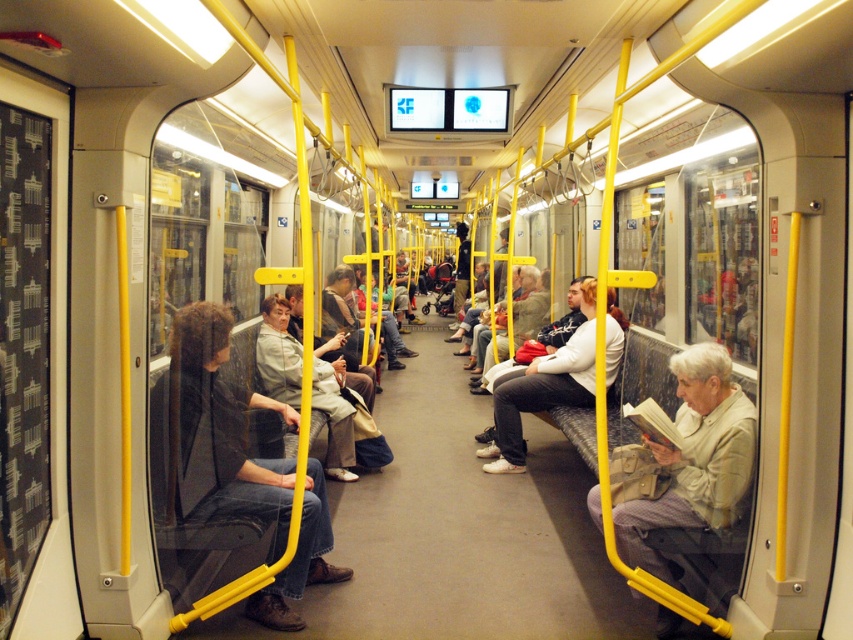
Can you confirm if dark gray jeans at center is shorter than light beige jacket at center?

In fact, dark gray jeans at center may be taller than light beige jacket at center.

Does dark gray jeans at center come behind light beige jacket at center?

Yes, it is.

Which is behind, point (227, 410) or point (675, 464)?

The point (227, 410) is more distant.

Identify the location of dark gray jeans at center. (213, 433).

Describe the element at coordinates (213, 433) in the screenshot. I see `dark gray jeans at center` at that location.

Where is `dark gray jeans at center`? This screenshot has width=853, height=640. dark gray jeans at center is located at coordinates (213, 433).

Between point (213, 461) and point (525, 390), which one is positioned in front?

Positioned in front is point (213, 461).

Locate an element on the screen. The height and width of the screenshot is (640, 853). dark gray jeans at center is located at coordinates (213, 433).

Can you confirm if light beige jacket at center is positioned to the left of white matte jacket at center?

Incorrect, light beige jacket at center is not on the left side of white matte jacket at center.

Can you confirm if light beige jacket at center is taller than white matte jacket at center?

In fact, light beige jacket at center may be shorter than white matte jacket at center.

Locate an element on the screen. This screenshot has width=853, height=640. light beige jacket at center is located at coordinates (695, 460).